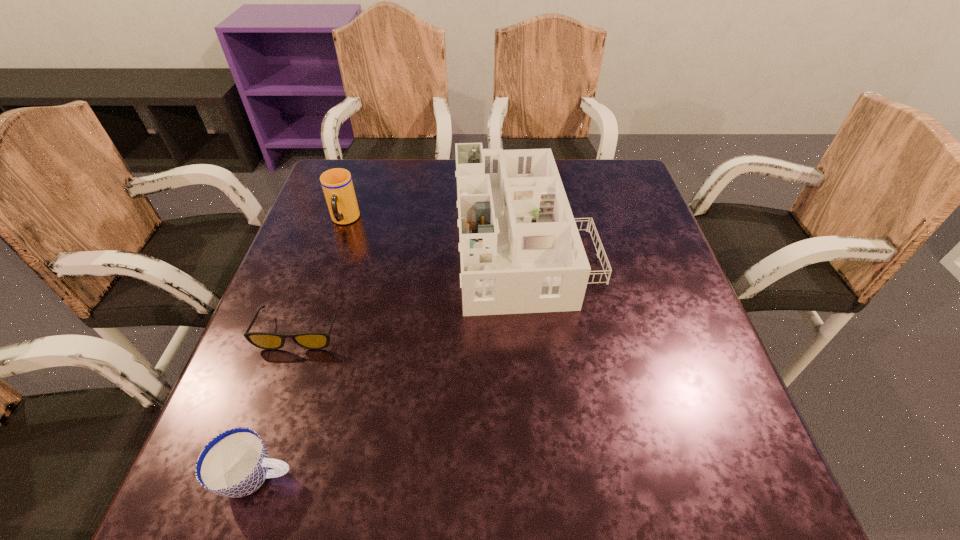
You are a GUI agent. You are given a task and a screenshot of the screen. Output one action in this format:
    pyautogui.click(x=<x>, y=<y>)
    Task: Click on the object that is at the near edge
    The width and height of the screenshot is (960, 540).
    Given the screenshot: What is the action you would take?
    pyautogui.click(x=235, y=463)

Where is `sunglasses that is at the left edge`? sunglasses that is at the left edge is located at coordinates (309, 340).

You are a GUI agent. You are given a task and a screenshot of the screen. Output one action in this format:
    pyautogui.click(x=<x>, y=<y>)
    Task: Click on the object that is at the near left corner
    This screenshot has height=540, width=960.
    Given the screenshot: What is the action you would take?
    pyautogui.click(x=235, y=463)

This screenshot has height=540, width=960. Find the location of `free space at the far edge of the desktop`. free space at the far edge of the desktop is located at coordinates (568, 195).

Where is `vacant region at the near edge of the desktop`? Image resolution: width=960 pixels, height=540 pixels. vacant region at the near edge of the desktop is located at coordinates (440, 475).

Identify the location of vacant region at the left edge of the desktop. The width and height of the screenshot is (960, 540). (315, 366).

Image resolution: width=960 pixels, height=540 pixels. In order to click on free space at the right edge of the desktop in this screenshot , I will do `click(701, 375)`.

Identify the location of vacant region at the far left corner of the desktop. (375, 188).

The width and height of the screenshot is (960, 540). I want to click on blank area at the far right corner, so click(599, 178).

Image resolution: width=960 pixels, height=540 pixels. I want to click on vacant point located between the dollhouse and the nearer cup, so click(x=391, y=357).